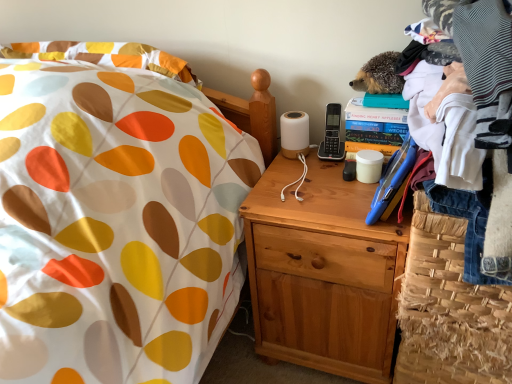
Image resolution: width=512 pixels, height=384 pixels. I want to click on empty space that is ontop of natural wood nightstand at center (from a real-world perspective), so click(323, 191).